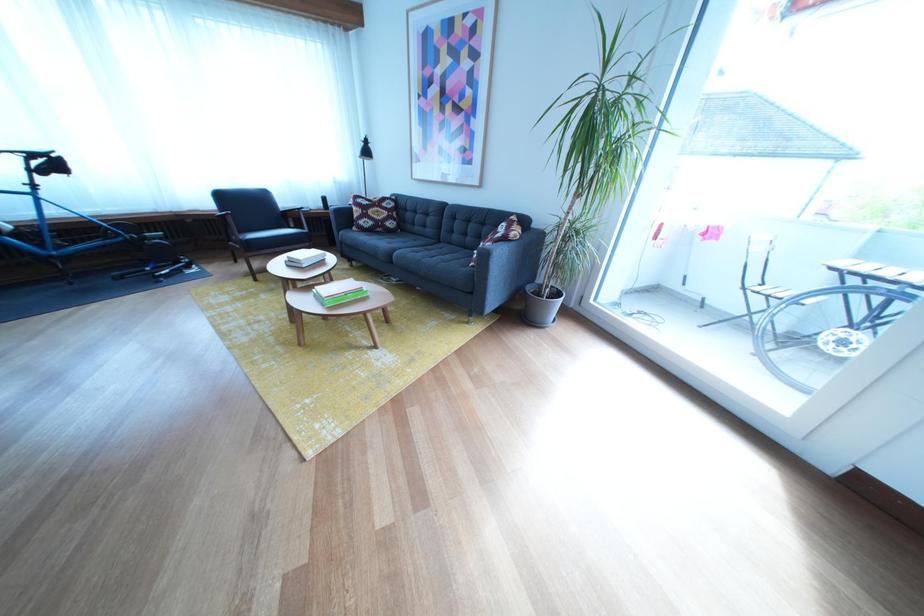
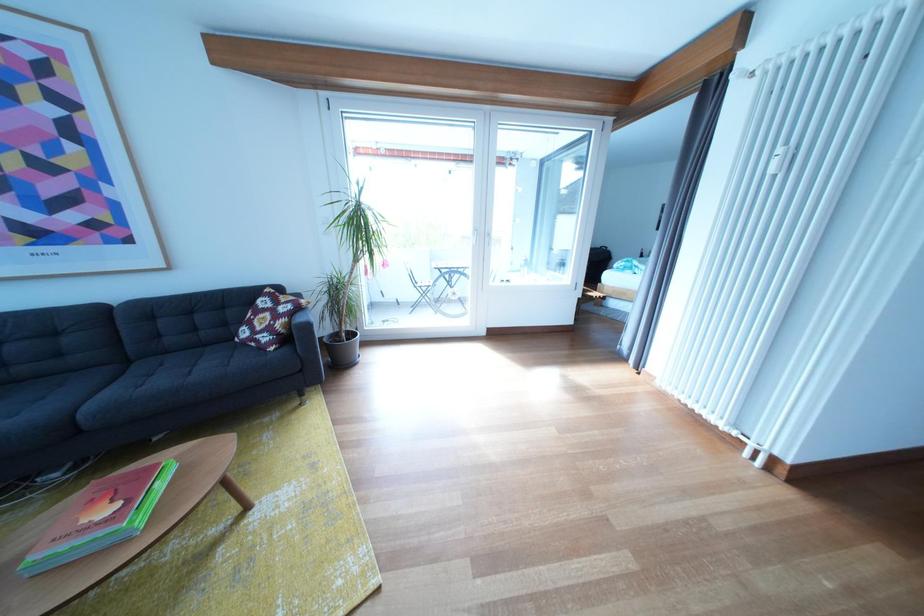
Where in the second image is the point corresponding to point (526, 220) from the first image?

(276, 293)